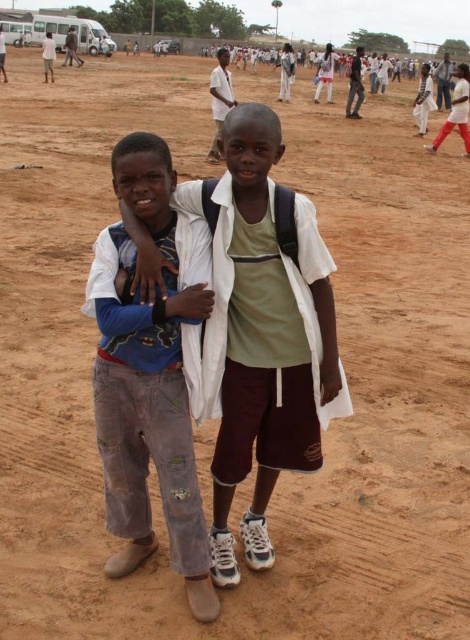
Measure the distance between light brown cotton shirt at center and washed denim pants at center.

light brown cotton shirt at center and washed denim pants at center are 10.24 inches apart.

Between point (141, 292) and point (132, 365), which one is positioned in front?

Point (141, 292)

Where is `light brown cotton shirt at center`? This screenshot has height=640, width=470. light brown cotton shirt at center is located at coordinates (263, 332).